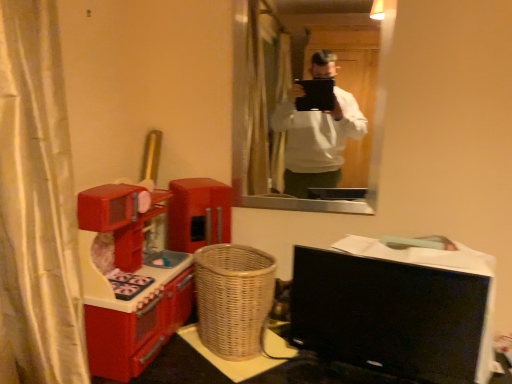
Question: Choose the correct answer: Is matte glass mirror at upper center inside black glossy computer monitor at lower right or outside it?

Choices:
 (A) outside
 (B) inside

Answer: (A)

Question: From a real-world perspective, is matte glass mirror at upper center above or below black glossy computer monitor at lower right?

Choices:
 (A) below
 (B) above

Answer: (B)

Question: Estimate the real-world distances between objects in this image. Which object is farther from the black glossy computer monitor at lower right?

Choices:
 (A) shiny plastic toy kitchen at left
 (B) matte glass mirror at upper center
 (C) woven wood table at lower center
 (D) woven brown basket at center

Answer: (B)

Question: Considering the real-world distances, which object is closest to the woven brown basket at center?

Choices:
 (A) shiny plastic toy kitchen at left
 (B) matte glass mirror at upper center
 (C) black glossy computer monitor at lower right
 (D) woven wood table at lower center

Answer: (D)